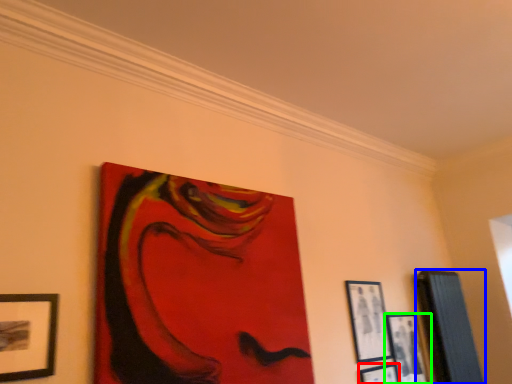
Question: Based on their relative distances, which object is farther from picture frame (highlighted by a red box)? Choose from picture frame (highlighted by a blue box) and picture frame (highlighted by a green box).

Choices:
 (A) picture frame
 (B) picture frame

Answer: (A)